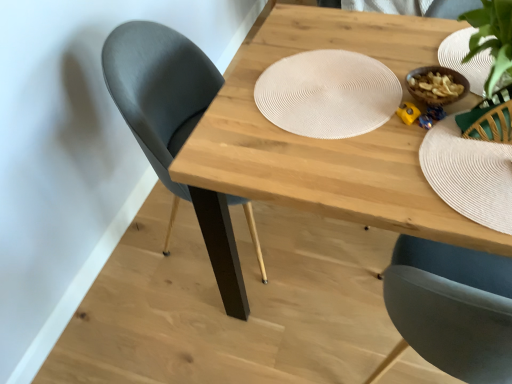
I want to click on vacant space underneath white woven placemat at center (from a real-world perspective), so click(325, 95).